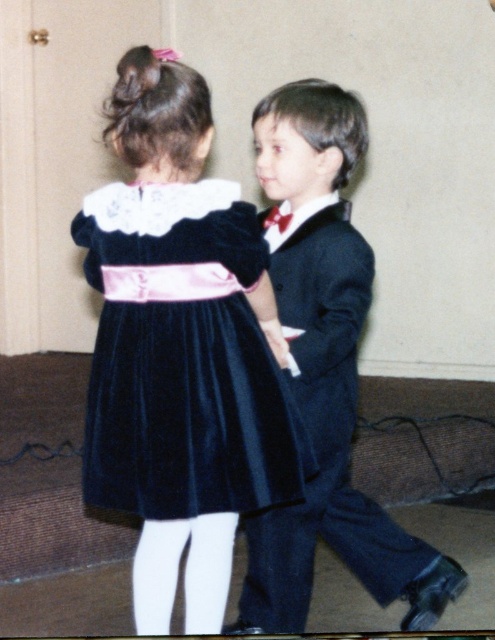
Which is below, velvet dark blue dress at center or velvet suit at center?

Positioned lower is velvet suit at center.

What are the coordinates of `velvet dark blue dress at center` in the screenshot? It's located at pos(183,358).

You are a GUI agent. You are given a task and a screenshot of the screen. Output one action in this format:
    pyautogui.click(x=<x>, y=<y>)
    Task: Click on the velvet dark blue dress at center
    
    Given the screenshot: What is the action you would take?
    pyautogui.click(x=183, y=358)

This screenshot has width=495, height=640. Find the location of `velvet dark blue dress at center`. velvet dark blue dress at center is located at coordinates (183, 358).